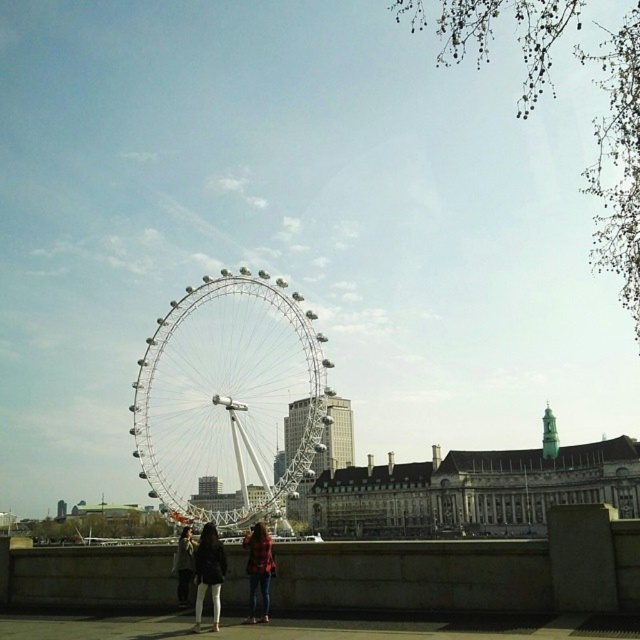
Is point (196, 595) in front of point (268, 580)?

No.

In the scene shown: Is black leather jacket at lower center thinner than flannel shirt at center?

No, black leather jacket at lower center is not thinner than flannel shirt at center.

Measure the distance between point (209, 538) and camera.

They are 80.63 meters apart.

You are a GUI agent. You are given a task and a screenshot of the screen. Output one action in this format:
    pyautogui.click(x=<x>, y=<y>)
    Task: Click on the black leather jacket at lower center
    This screenshot has width=640, height=640.
    Given the screenshot: What is the action you would take?
    pyautogui.click(x=209, y=573)

Locate an element on the screen. flannel shirt at center is located at coordinates (259, 568).

Can you confirm if flannel shirt at center is positioned to the right of dark brown leather jacket at lower center?

Correct, you'll find flannel shirt at center to the right of dark brown leather jacket at lower center.

Locate an element on the screen. The width and height of the screenshot is (640, 640). flannel shirt at center is located at coordinates (259, 568).

Where is `flannel shirt at center`? Image resolution: width=640 pixels, height=640 pixels. flannel shirt at center is located at coordinates (259, 568).

Which is more to the left, black leather jacket at lower center or dark brown leather jacket at lower center?

dark brown leather jacket at lower center

Consider the image. Measure the distance between point (212, 608) and camera.

The distance of point (212, 608) from camera is 79.13 meters.

You are a GUI agent. You are given a task and a screenshot of the screen. Output one action in this format:
    pyautogui.click(x=<x>, y=<y>)
    Task: Click on the black leather jacket at lower center
    This screenshot has height=640, width=640.
    Given the screenshot: What is the action you would take?
    pyautogui.click(x=209, y=573)